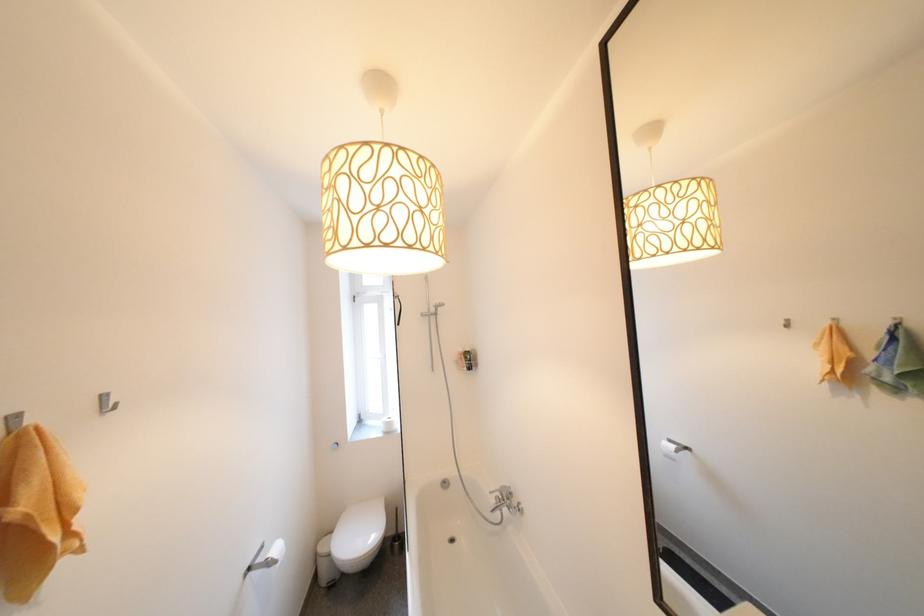
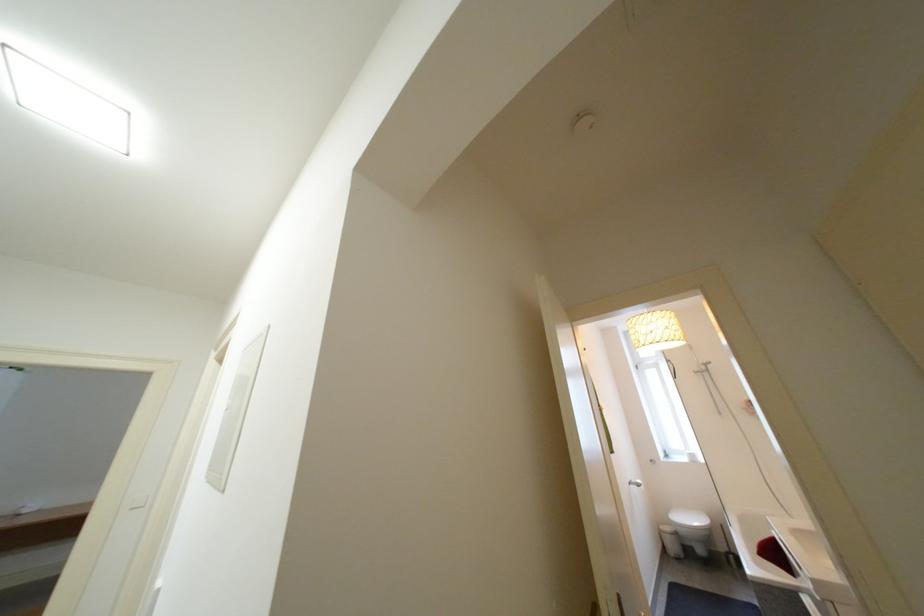
Find the pixel in the second image that matches point 259,570 in the first image.

(639, 485)